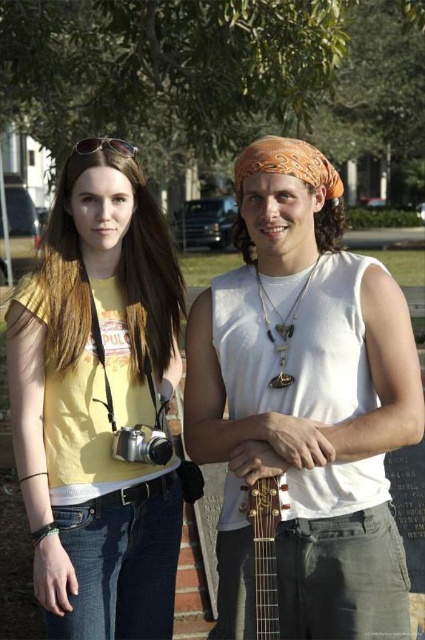
Question: Is orange bandana at center below sunglasses at upper left?

Choices:
 (A) no
 (B) yes

Answer: (B)

Question: Based on their relative distances, which object is nearer to the sunglasses at upper left?

Choices:
 (A) orange bandana at center
 (B) wooden acoustic guitar at center

Answer: (A)

Question: Among these objects, which one is nearest to the camera?

Choices:
 (A) wooden acoustic guitar at center
 (B) sunglasses at upper left
 (C) orange bandana at center

Answer: (C)

Question: Is wooden acoustic guitar at center in front of sunglasses at upper left?

Choices:
 (A) yes
 (B) no

Answer: (A)

Question: Can you confirm if yellow matte t-shirt at center is thinner than wooden acoustic guitar at center?

Choices:
 (A) no
 (B) yes

Answer: (A)

Question: Which object appears farthest from the camera in this image?

Choices:
 (A) orange bandana at center
 (B) sunglasses at upper left
 (C) yellow matte t-shirt at center

Answer: (B)